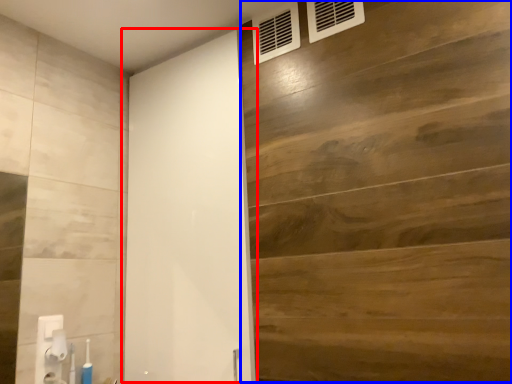
Question: Which point is further to the camera, barn door (highlighted by a red box) or plywood (highlighted by a blue box)?

Choices:
 (A) barn door
 (B) plywood

Answer: (A)